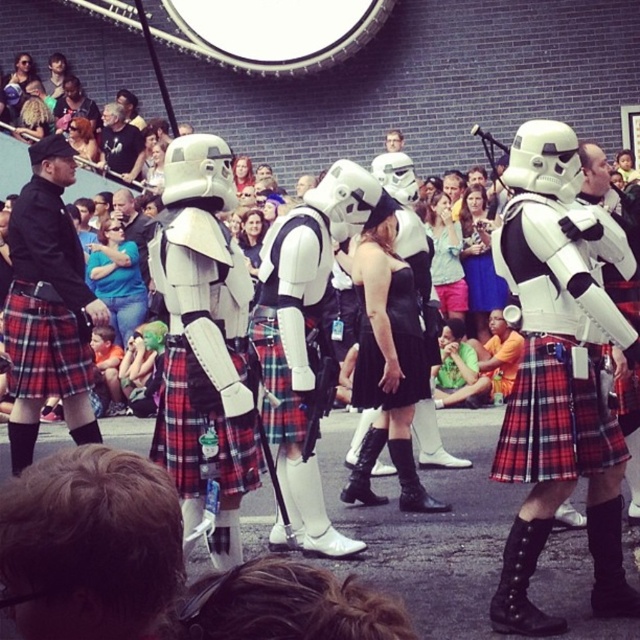
Question: From the image, what is the correct spatial relationship of plaid fabric kilt at center in relation to dark gray t-shirt at center?

Choices:
 (A) right
 (B) left

Answer: (A)

Question: Is white matte stormtrooper at center further to camera compared to plaid fabric kilt at center?

Choices:
 (A) no
 (B) yes

Answer: (A)

Question: Which object is positioned closest to the plaid fabric kilt at center?

Choices:
 (A) white matte stormtrooper at center
 (B) black kilt at left

Answer: (A)

Question: Is black kilt at left to the left of dark gray t-shirt at center from the viewer's perspective?

Choices:
 (A) no
 (B) yes

Answer: (B)

Question: Among these points, which one is farthest from the camera?

Choices:
 (A) (115, 152)
 (B) (81, 396)

Answer: (A)

Question: Which object appears farthest from the camera in this image?

Choices:
 (A) white matte stormtrooper at center
 (B) plaid fabric kilt at center
 (C) dark gray t-shirt at center
 (D) black kilt at left

Answer: (C)